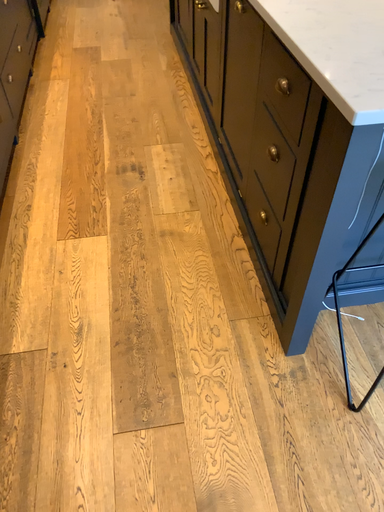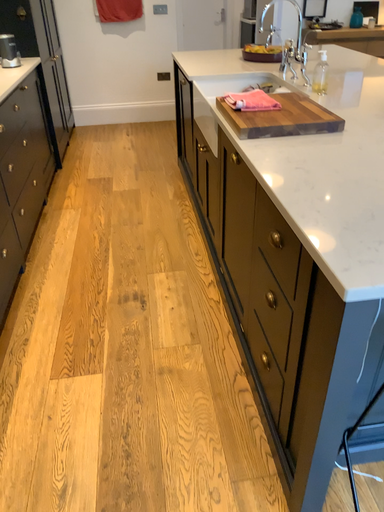
Question: How did the camera likely rotate when shooting the video?

Choices:
 (A) rotated downward
 (B) rotated upward

Answer: (B)